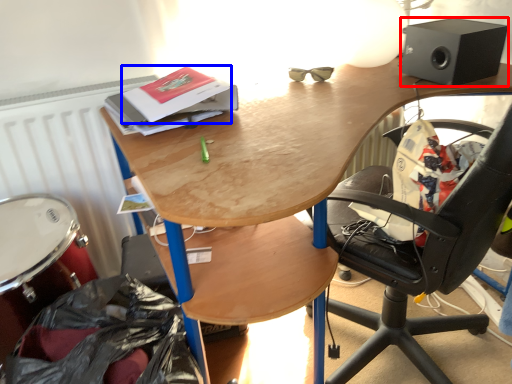
Question: Which object appears farthest to the camera in this image, loudspeaker (highlighted by a red box) or paperback book (highlighted by a blue box)?

Choices:
 (A) loudspeaker
 (B) paperback book

Answer: (A)